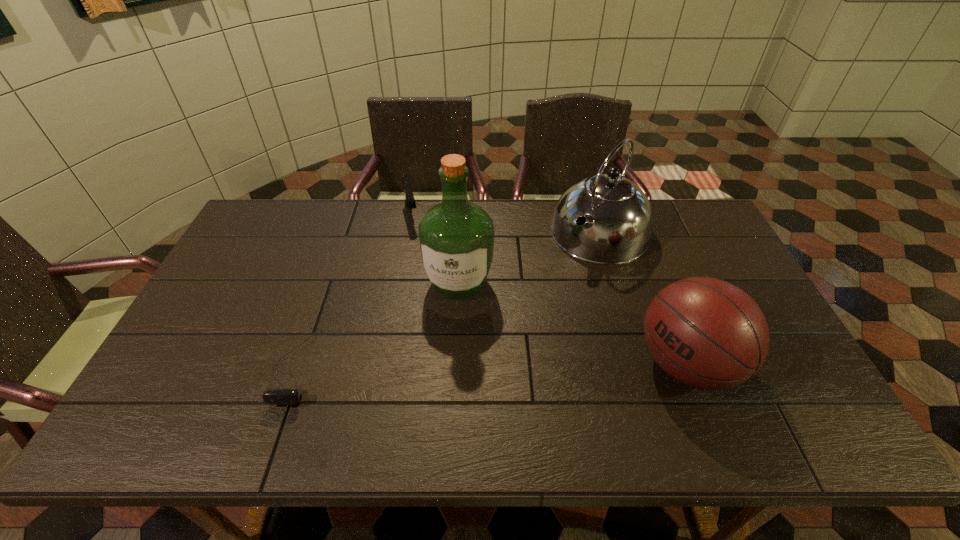
Locate an element on the screen. the shortest object is located at coordinates (281, 396).

You are a GUI agent. You are given a task and a screenshot of the screen. Output one action in this format:
    pyautogui.click(x=<x>, y=<y>)
    Task: Click on the webcam
    The image size is (960, 540).
    Given the screenshot: What is the action you would take?
    pyautogui.click(x=281, y=396)

This screenshot has height=540, width=960. Identify the location of basketball. (706, 333).

You are a GUI agent. You are given a task and a screenshot of the screen. Output one action in this format:
    pyautogui.click(x=<x>, y=<y>)
    Task: Click on the liquor
    The height and width of the screenshot is (540, 960).
    Given the screenshot: What is the action you would take?
    pyautogui.click(x=456, y=237)

This screenshot has height=540, width=960. I want to click on the third object from right to left, so click(456, 237).

At what (x,y) coordinates should I click in order to perform the action: click on kettle. Please return your answer as a coordinate pair (x, y). Looking at the image, I should click on (619, 221).

At what (x,y) coordinates should I click in order to perform the action: click on the fourth object from right to left. Please return your answer as a coordinate pair (x, y). Looking at the image, I should click on pos(409,197).

At what (x,y) coordinates should I click in order to perform the action: click on the fourth tallest object. Please return your answer as a coordinate pair (x, y). Looking at the image, I should click on (409, 197).

Identify the location of vacant space located on the left of the basketball. This screenshot has width=960, height=540. (580, 363).

Find the location of `vacant space situated 0.220m on the front-facing side of the tallest object`. vacant space situated 0.220m on the front-facing side of the tallest object is located at coordinates (444, 376).